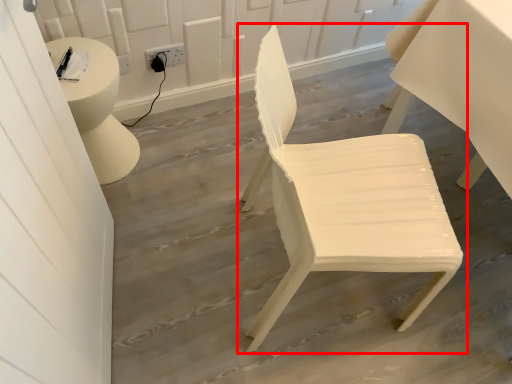
Question: From the image's perspective, what is the correct spatial positioning of chair (annotated by the red box) in reference to electric outlet?

Choices:
 (A) above
 (B) below

Answer: (B)